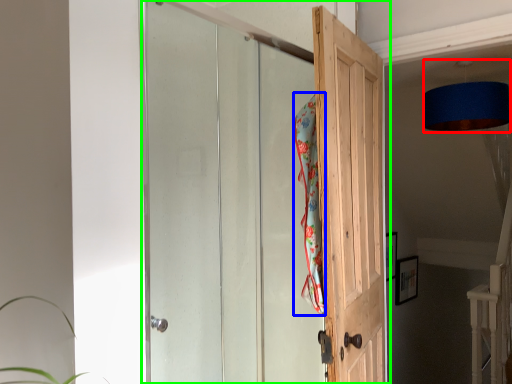
Question: Which is farther away from lamp (highlighted by a red box)? beach towel (highlighted by a blue box) or door (highlighted by a green box)?

Choices:
 (A) beach towel
 (B) door

Answer: (B)